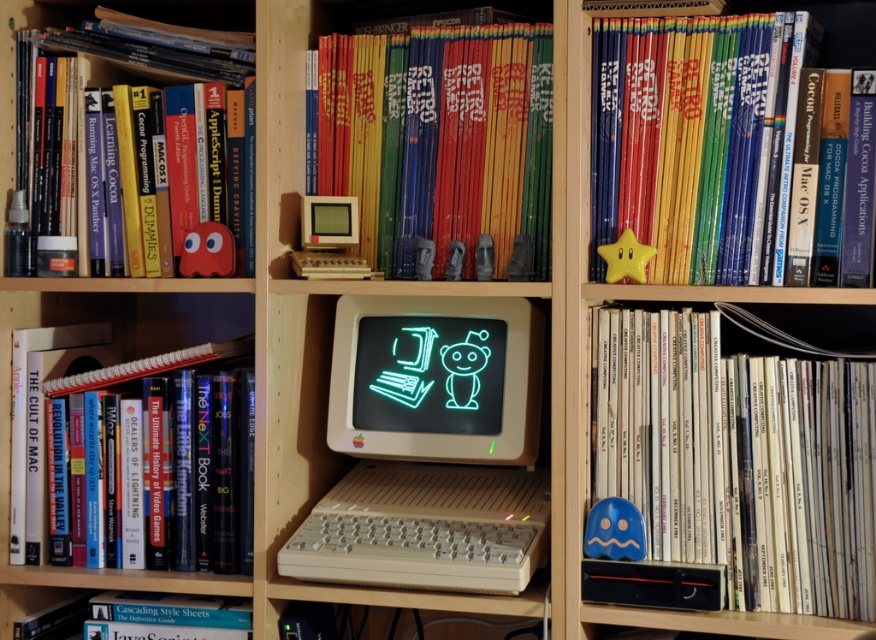
Can you confirm if hardcover book at center is shorter than yellow matte star at upper right?

Correct, hardcover book at center is not as tall as yellow matte star at upper right.

From the picture: Does hardcover book at center appear on the right side of yellow matte star at upper right?

In fact, hardcover book at center is to the left of yellow matte star at upper right.

Is point (318, 230) in front of point (742, 144)?

No, it is behind (742, 144).

I want to click on hardcover book at center, so click(x=440, y=147).

Locate an element on the screen. This screenshot has width=876, height=640. neon plastic monitor at center is located at coordinates (436, 378).

Is neon plastic monitor at center thinner than spiral-bound paper notebook at left?

Yes.

Image resolution: width=876 pixels, height=640 pixels. In order to click on neon plastic monitor at center in this screenshot , I will do `click(436, 378)`.

Between yellow matte book at upper left and hardcover book at lower left, which one appears on the right side from the viewer's perspective?

From the viewer's perspective, hardcover book at lower left appears more on the right side.

Is yellow matte book at upper left above hardcover book at lower left?

Yes.

Is point (112, 52) in front of point (100, 628)?

No, (112, 52) is behind (100, 628).

Where is `yellow matte book at upper left`? The width and height of the screenshot is (876, 640). yellow matte book at upper left is located at coordinates (90, 122).